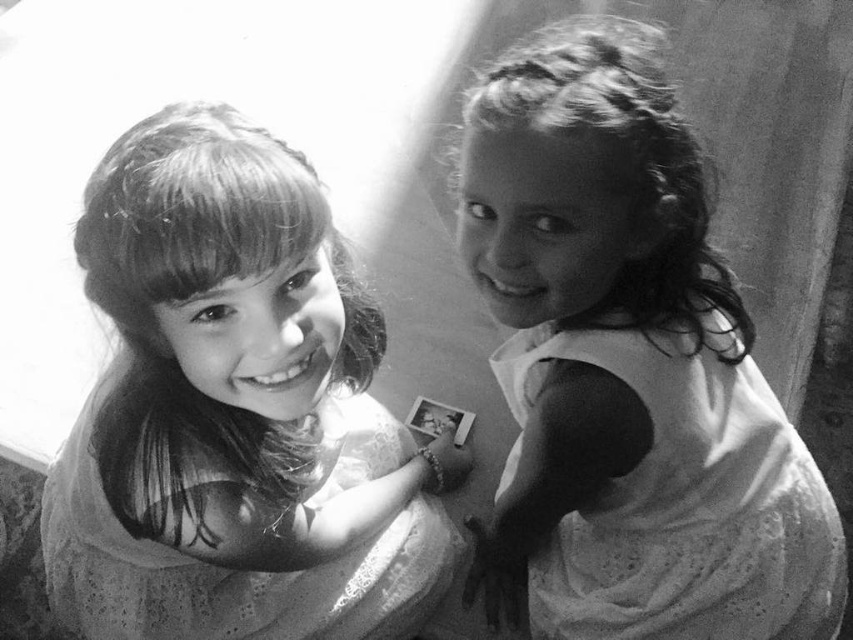
You are a fashion designer looking to create a new dress collection. You observe two dresses in the image, the smooth white dress at right and the white lace dress at right. Which dress has a wider silhouette?

The smooth white dress at right has a wider silhouette than the white lace dress at right as its width surpasses the latter.

From the picture: Based on the scene description, which dress is taller, the smooth fabric dress at upper left or the white lace dress at right?

The smooth fabric dress at upper left is taller than the white lace dress at right.

You are an interior designer analyzing the clothing items in the image. Which dress is positioned higher in the scene, the smooth white dress at right or the smooth fabric dress at upper left?

The smooth white dress at right is located above the smooth fabric dress at upper left, so it is positioned higher in the scene.